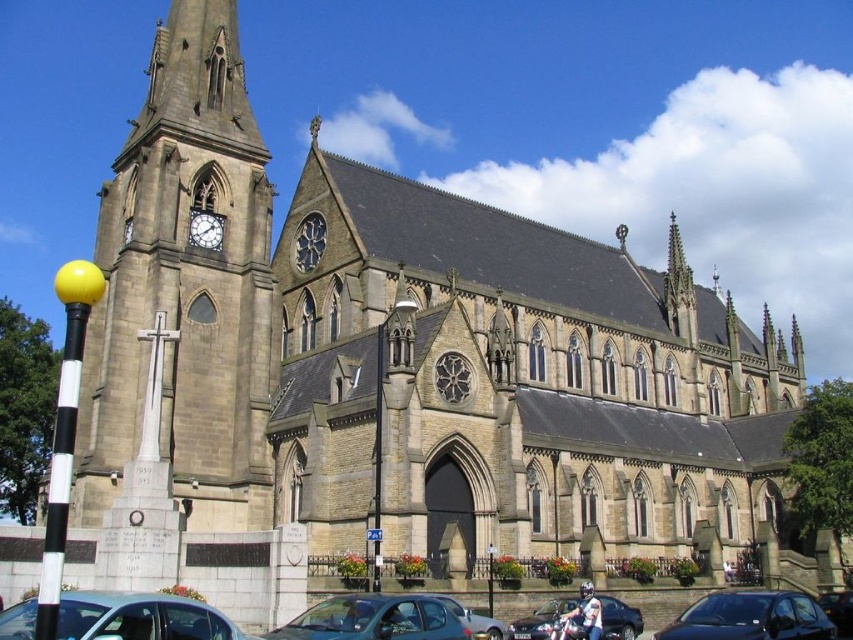
You are a pedestrian standing in front of the Gothic church and want to cross the street. There are two cars parked near the church facade. The metallic blue car at lower left and the shiny black car at lower right. Which car is closer to you as you face the church?

The metallic blue car at lower left is closer to you because it is in front of the shiny black car at lower right.

You are a pedestrian standing in front of the grand Gothic church. You see a metallic blue car at lower left and a shiny black car at lower right. Which car is positioned further to the left side of the church?

The metallic blue car at lower left is positioned further to the left side of the church compared to the shiny black car at lower right.